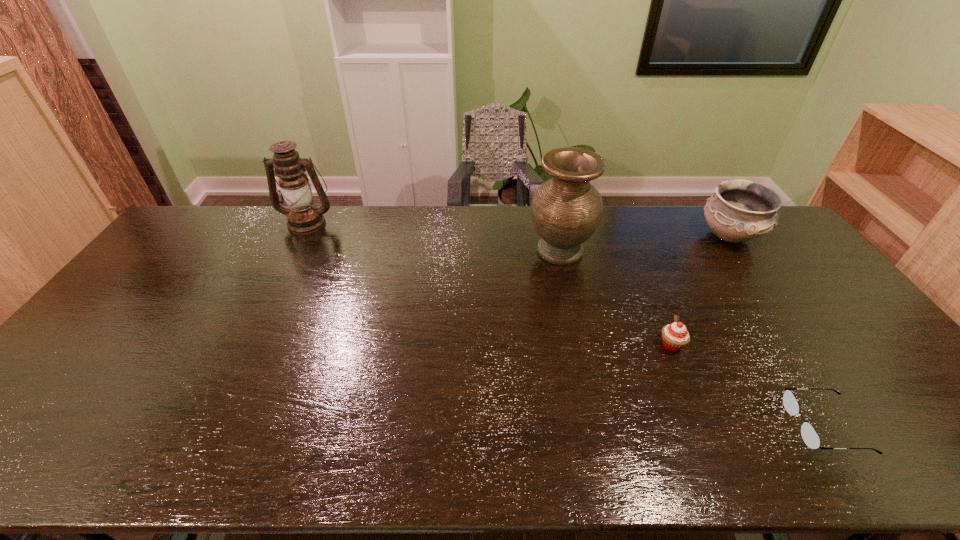
Image resolution: width=960 pixels, height=540 pixels. I want to click on vacant space in between the pottery and the third object from right to left, so click(701, 291).

You are a GUI agent. You are given a task and a screenshot of the screen. Output one action in this format:
    pyautogui.click(x=<x>, y=<y>)
    Task: Click on the free space between the leftmost object and the second nearest object
    
    Given the screenshot: What is the action you would take?
    tap(490, 284)

What are the coordinates of `vacant point located between the lantern and the shortest object` in the screenshot? It's located at point(566,324).

What are the coordinates of `object that is the fourth closest one to the pottery` in the screenshot? It's located at tap(303, 218).

This screenshot has height=540, width=960. Find the location of `object that is the third closest to the spectacles`. object that is the third closest to the spectacles is located at coordinates (566, 210).

Find the location of `free region that satisfies the following two spatial constraints: 1. on the front side of the fourth object from right to left; 2. on the left side of the fourth tallest object`. free region that satisfies the following two spatial constraints: 1. on the front side of the fourth object from right to left; 2. on the left side of the fourth tallest object is located at coordinates (580, 345).